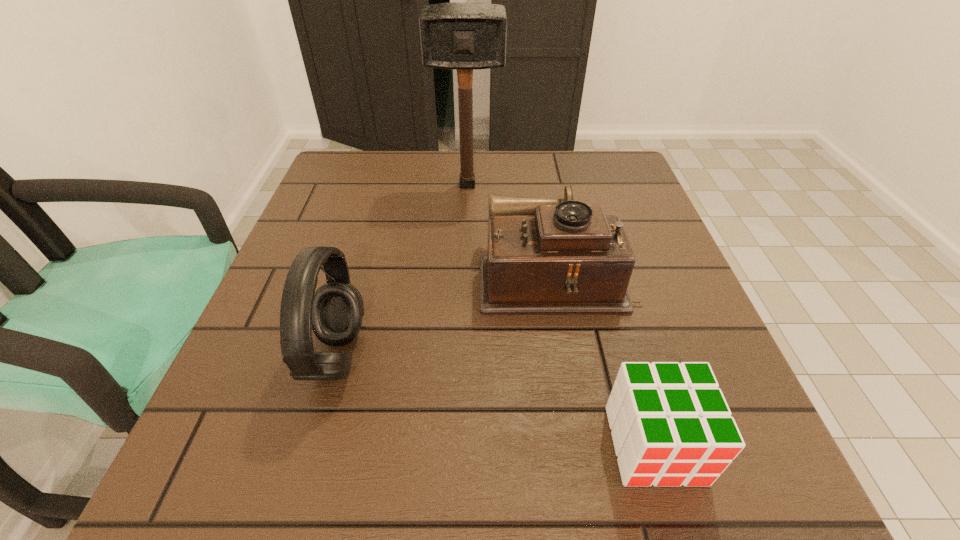
Image resolution: width=960 pixels, height=540 pixels. In order to click on free space between the headset and the tallest object in this screenshot , I will do `click(402, 271)`.

Identify the location of vacant region between the third shortest object and the cube. (495, 400).

Locate an element on the screen. This screenshot has width=960, height=540. vacant point located between the shortest object and the leftmost object is located at coordinates (495, 400).

Where is `the closest object to the shortest object`? the closest object to the shortest object is located at coordinates (545, 256).

The width and height of the screenshot is (960, 540). Identify the location of object that is the third closest to the cube. (456, 36).

Where is `vacant space that satisfies the following two spatial constraints: 1. on the front side of the farthest object; 2. on the earcups of the leftmost object`? The height and width of the screenshot is (540, 960). vacant space that satisfies the following two spatial constraints: 1. on the front side of the farthest object; 2. on the earcups of the leftmost object is located at coordinates (461, 356).